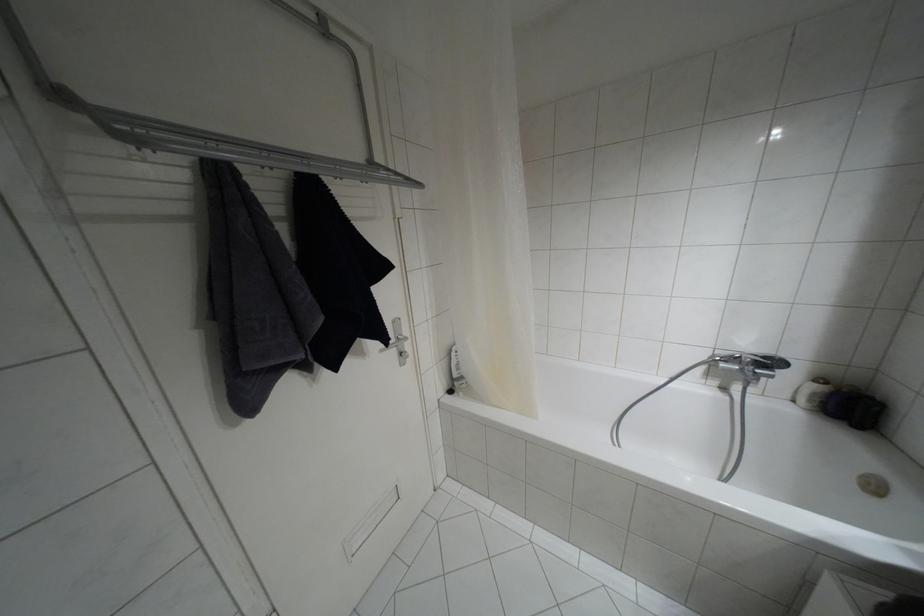
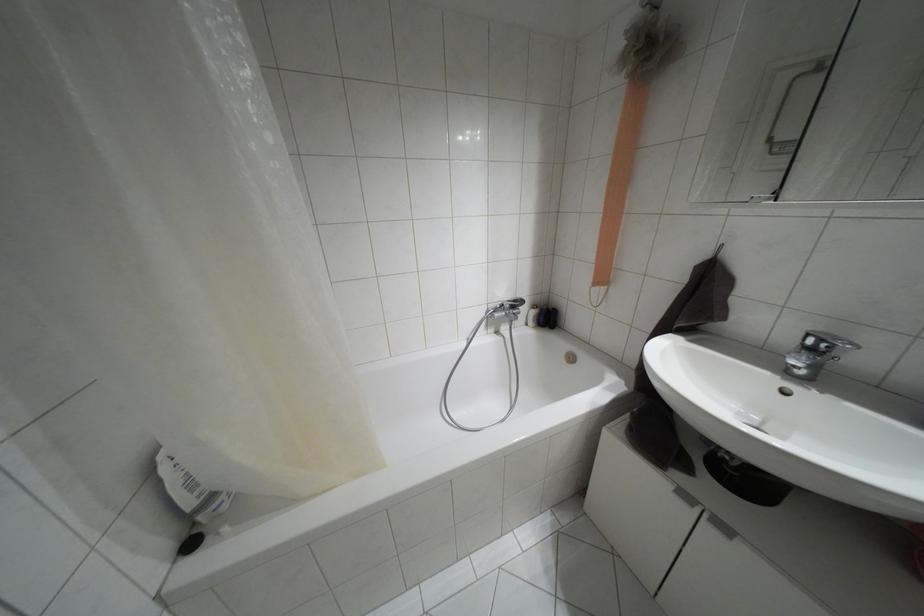
In the second image, find the point that corresponds to point 460,377 in the first image.

(212, 496)